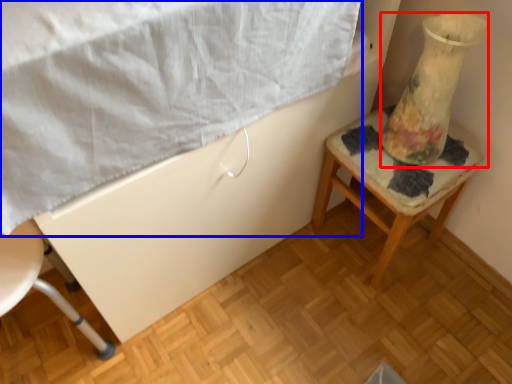
Question: Among these objects, which one is farthest to the camera, glass vase (highlighted by a red box) or sheet (highlighted by a blue box)?

Choices:
 (A) glass vase
 (B) sheet

Answer: (A)